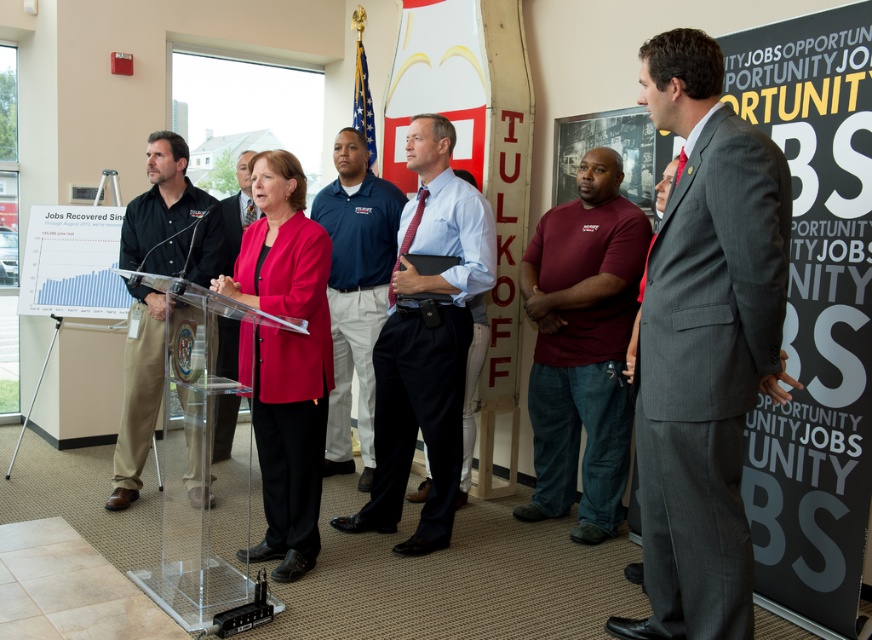
Question: Considering the real-world distances, which object is farthest from the gray pinstripe suit at center?

Choices:
 (A) black shirt at left
 (B) white paper chart at center
 (C) blue shirt at center
 (D) matte red blazer at center

Answer: (B)

Question: Does transparent acrylic podium at center appear under blue shirt at center?

Choices:
 (A) no
 (B) yes

Answer: (B)

Question: Can you confirm if gray pinstripe suit at center is bigger than transparent acrylic podium at center?

Choices:
 (A) no
 (B) yes

Answer: (A)

Question: Which point is closer to the camera?

Choices:
 (A) (604, 198)
 (B) (130, 390)
 (C) (700, 300)
 (D) (70, 305)

Answer: (C)

Question: Estimate the real-world distances between objects in this image. Which object is closer to the black matte poster at center?

Choices:
 (A) maroon t-shirt at center
 (B) blue shirt at center
 (C) matte black suit at center
 (D) matte red blazer at center

Answer: (A)

Question: Where is transparent acrylic podium at center located in relation to white paper chart at center in the image?

Choices:
 (A) left
 (B) right

Answer: (B)